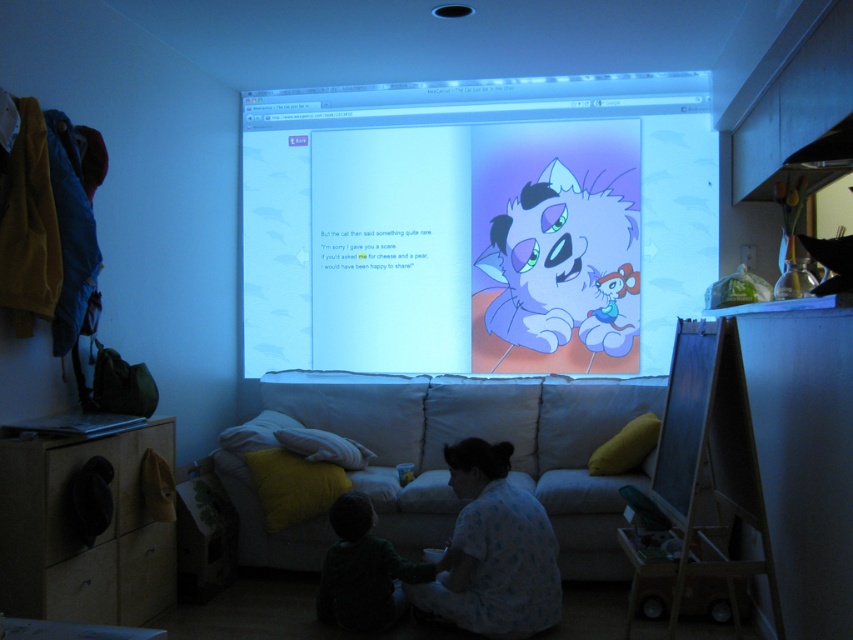
You are a guest in this room and want to choose between the light blue cotton pajamas at lower center and the dark green sweater at lower left to wear for a short walk outside. Based on their sizes, which one might be more suitable for layering under a coat?

The light blue cotton pajamas at lower center is taller than the dark green sweater at lower left, so it might be more suitable for layering under a coat as it has a longer length to provide better coverage.